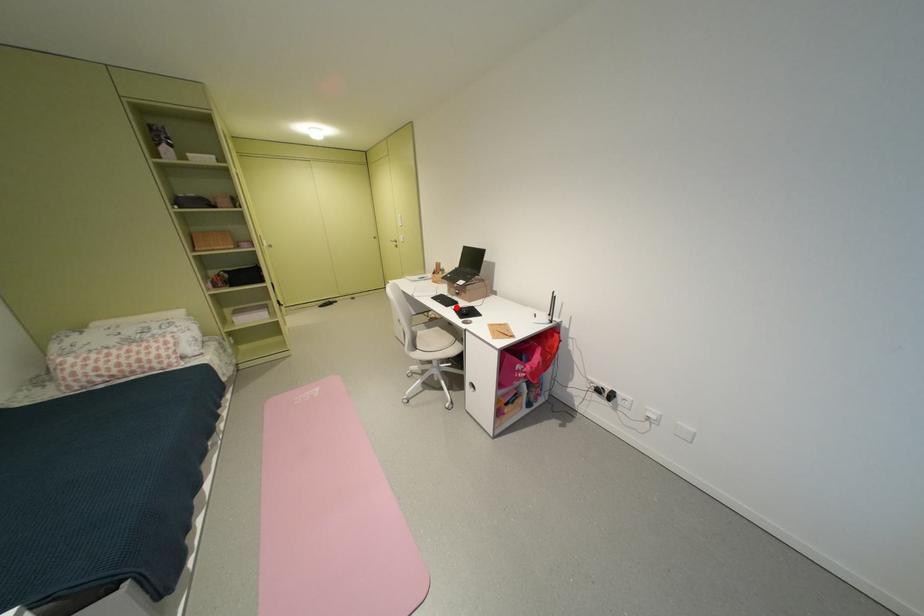
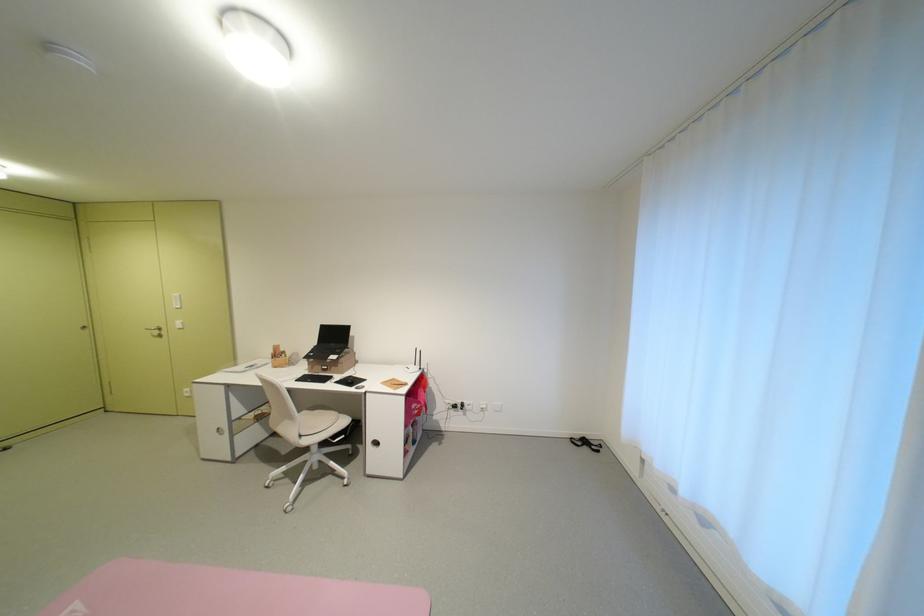
Find the pixel in the second image that matches the highlighted location in the first image.

(334, 383)